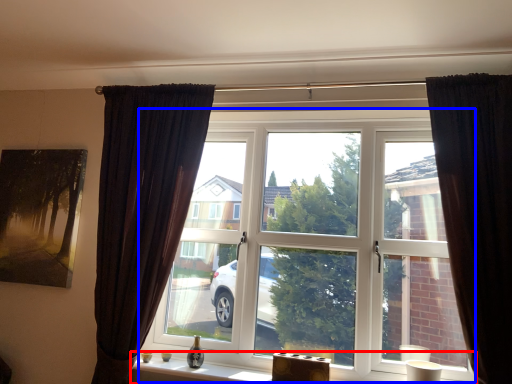
Question: Which object is closer to the camera taking this photo, window sill (highlighted by a red box) or window (highlighted by a blue box)?

Choices:
 (A) window sill
 (B) window

Answer: (A)